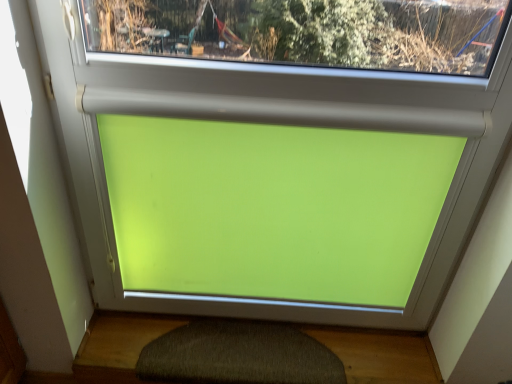
Image resolution: width=512 pixels, height=384 pixels. What do you see at coordinates (238, 355) in the screenshot?
I see `dark gray textured bath mat at bottom` at bounding box center [238, 355].

The width and height of the screenshot is (512, 384). Identify the location of dark gray textured bath mat at bottom. (238, 355).

Locate an element on the screen. The image size is (512, 384). dark gray textured bath mat at bottom is located at coordinates (238, 355).